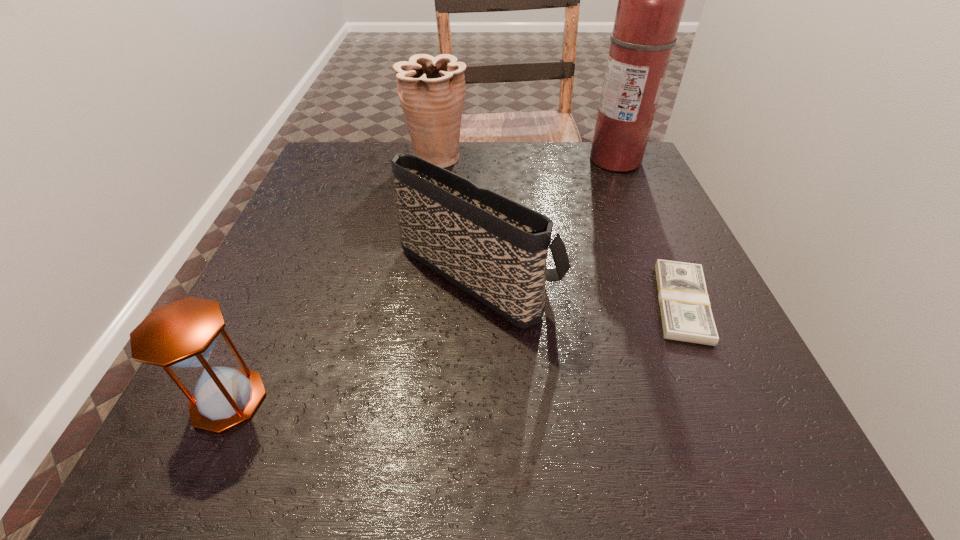
I want to click on unoccupied position between the dollar and the fire extinguisher, so (649, 232).

Find the location of a particular element. free space between the urn and the tallest object is located at coordinates (526, 160).

Where is `free space between the urn and the dollar`? This screenshot has width=960, height=540. free space between the urn and the dollar is located at coordinates (559, 231).

Locate an element on the screen. The width and height of the screenshot is (960, 540). vacant region between the urn and the leftmost object is located at coordinates (332, 279).

You are a GUI agent. You are given a task and a screenshot of the screen. Output one action in this format:
    pyautogui.click(x=<x>, y=<y>)
    Task: Click on the vacant region between the handbag and the fourth tallest object
    The height and width of the screenshot is (540, 960).
    Given the screenshot: What is the action you would take?
    pyautogui.click(x=353, y=334)

In order to click on vacant area between the tallest object and the leftmost object in this screenshot , I will do `click(422, 280)`.

Find the location of a particular element. The image size is (960, 540). free space between the fire extinguisher and the dollar is located at coordinates (649, 232).

Locate an element on the screen. Image resolution: width=960 pixels, height=540 pixels. object that is the closest to the handbag is located at coordinates (686, 315).

Locate an element on the screen. Image resolution: width=960 pixels, height=540 pixels. object that is the second closest to the fire extinguisher is located at coordinates (686, 315).

What are the coordinates of `vacant space that satisfies the following two spatial constraints: 1. on the front-facing side of the tallest object; 2. on the left side of the dollar` in the screenshot? It's located at (678, 303).